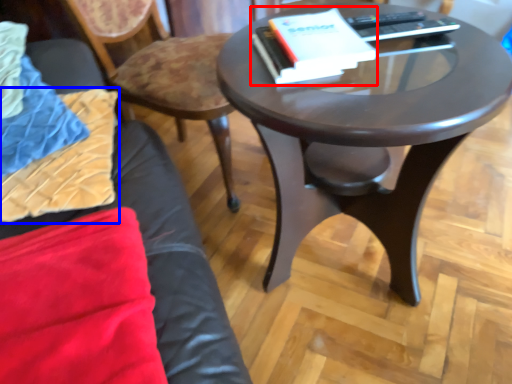
Question: Among these objects, which one is farthest to the camera, paperback book (highlighted by a red box) or pillow (highlighted by a blue box)?

Choices:
 (A) paperback book
 (B) pillow

Answer: (A)